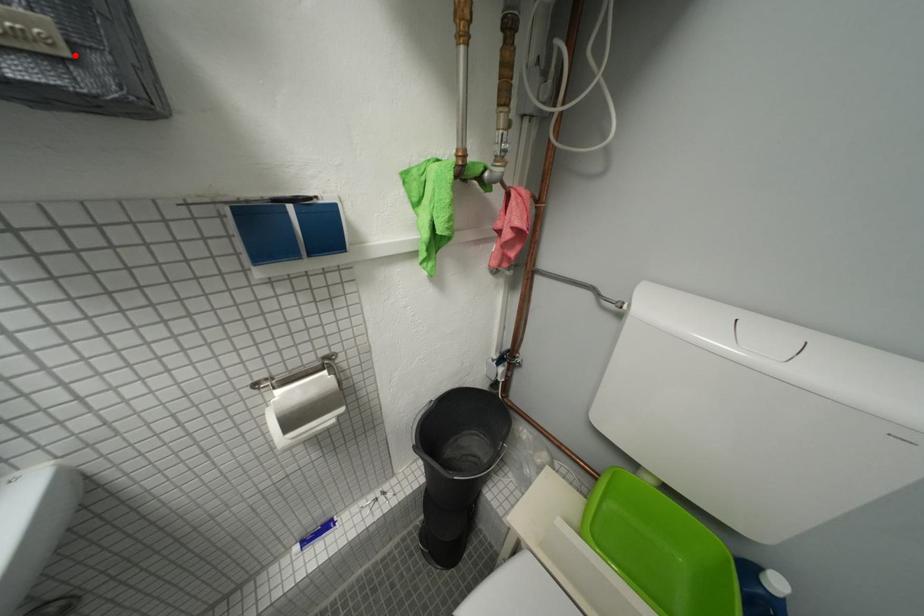
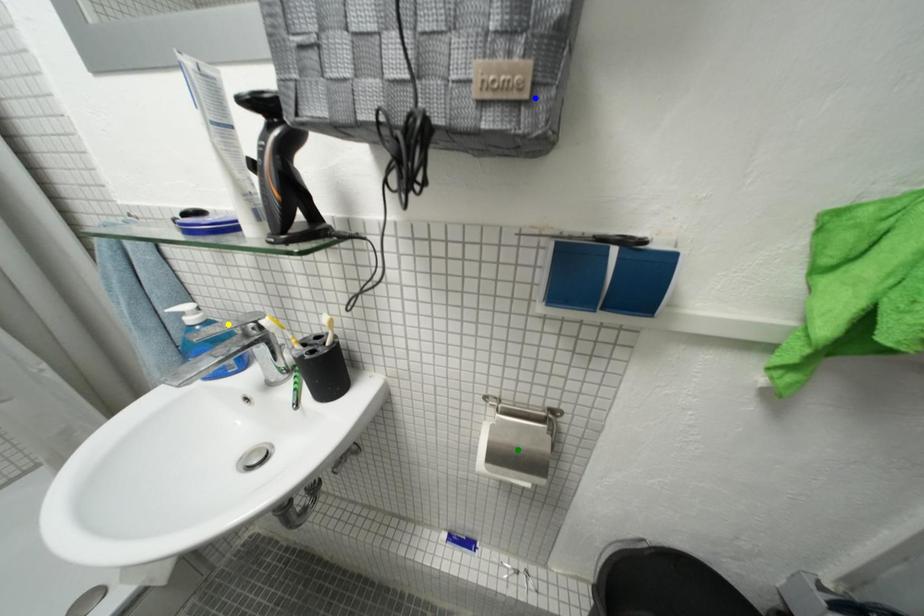
Question: I am providing you with two images of the same scene from different viewpoints. A red point is marked on the first image. You are given multiple points on the second image. Which spot in image 2 lines up with the point in image 1?

Choices:
 (A) yellow point
 (B) green point
 (C) blue point

Answer: (C)